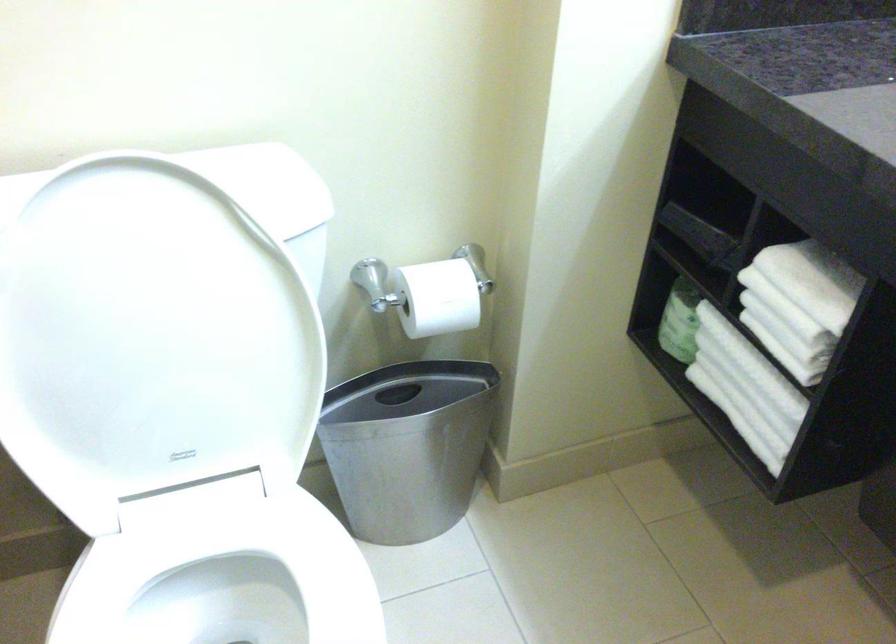
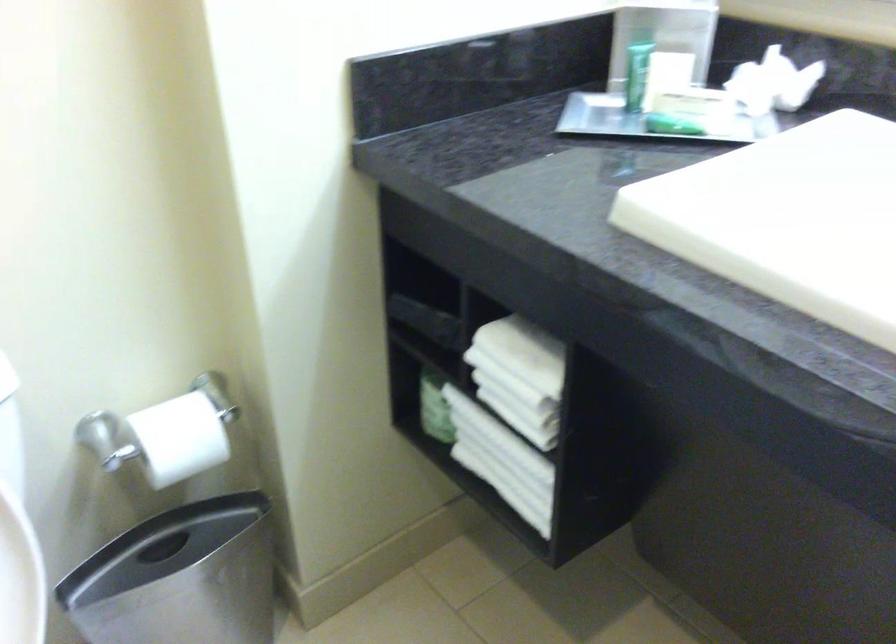
Question: In a continuous first-person perspective shot, in which direction is the camera moving?

Choices:
 (A) Left
 (B) Right
 (C) Forward
 (D) Backward

Answer: (B)